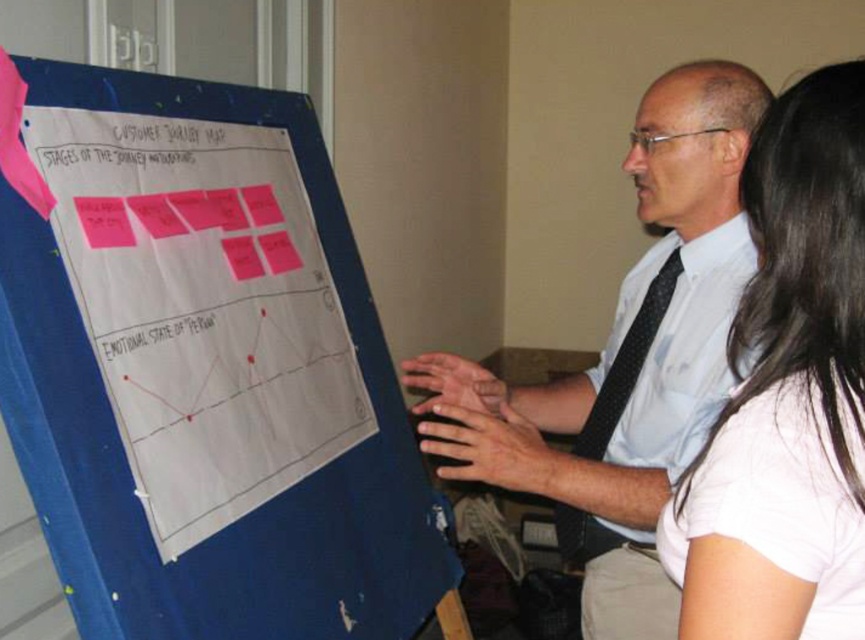
You are an office assistant who needs to hang a new poster on the wall. The poster is taller than the blue fabric bulletin board at left. Where should you place the poster so it doesn not cover the white shirt at center?

Since the blue fabric bulletin board at left is below the white shirt at center, you should place the poster above the blue fabric bulletin board at left to avoid covering the white shirt at center.

You are standing in the office and want to write a note on the blue fabric bulletin board at left. Can you reach it easily?

The blue fabric bulletin board at left is 35.96 inches away from the viewer, so yes, you can reach it easily since it is within a comfortable distance.